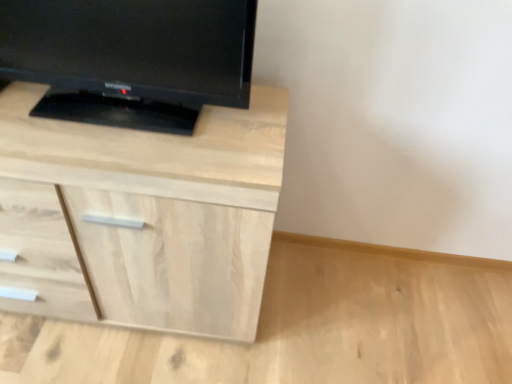
Locate an element on the screen. light wood chest of drawers at upper left is located at coordinates (150, 215).

Describe the element at coordinates (150, 215) in the screenshot. I see `light wood chest of drawers at upper left` at that location.

This screenshot has height=384, width=512. I want to click on matte black tv at upper left, so click(130, 58).

Describe the element at coordinates (130, 58) in the screenshot. I see `matte black tv at upper left` at that location.

At what (x,y) coordinates should I click in order to perform the action: click on light wood chest of drawers at upper left. Please return your answer as a coordinate pair (x, y). This screenshot has height=384, width=512. Looking at the image, I should click on (150, 215).

Between light wood chest of drawers at upper left and matte black tv at upper left, which one appears on the left side from the viewer's perspective?

light wood chest of drawers at upper left.

Is light wood chest of drawers at upper left further to the viewer compared to matte black tv at upper left?

Yes, light wood chest of drawers at upper left is behind matte black tv at upper left.

Does point (93, 172) come closer to viewer compared to point (55, 90)?

Yes, point (93, 172) is closer to viewer.

From the image's perspective, which one is positioned lower, light wood chest of drawers at upper left or matte black tv at upper left?

light wood chest of drawers at upper left.

From a real-world perspective, is light wood chest of drawers at upper left positioned under matte black tv at upper left based on gravity?

Indeed, from a real-world perspective, light wood chest of drawers at upper left is positioned beneath matte black tv at upper left.

In the scene shown: Considering the relative sizes of light wood chest of drawers at upper left and matte black tv at upper left in the image provided, is light wood chest of drawers at upper left wider than matte black tv at upper left?

Yes, light wood chest of drawers at upper left is wider than matte black tv at upper left.

Who is taller, light wood chest of drawers at upper left or matte black tv at upper left?

Standing taller between the two is light wood chest of drawers at upper left.

Does light wood chest of drawers at upper left have a smaller size compared to matte black tv at upper left?

Actually, light wood chest of drawers at upper left might be larger than matte black tv at upper left.

In the scene shown: Is light wood chest of drawers at upper left situated inside matte black tv at upper left or outside?

light wood chest of drawers at upper left cannot be found inside matte black tv at upper left.

Are light wood chest of drawers at upper left and matte black tv at upper left located far from each other?

That's not correct — light wood chest of drawers at upper left is a little close to matte black tv at upper left.

Is light wood chest of drawers at upper left looking in the opposite direction of matte black tv at upper left?

No, light wood chest of drawers at upper left is not facing away from matte black tv at upper left.

Locate an element on the screen. The image size is (512, 384). television above the light wood chest of drawers at upper left (from a real-world perspective) is located at coordinates (130, 58).

Based on their positions, is matte black tv at upper left located to the left or right of light wood chest of drawers at upper left?

Clearly, matte black tv at upper left is on the right of light wood chest of drawers at upper left in the image.

Considering their positions, is matte black tv at upper left located in front of or behind light wood chest of drawers at upper left?

Clearly, matte black tv at upper left is in front of light wood chest of drawers at upper left.

Is point (245, 102) less distant than point (30, 150)?

That is False.

From the image's perspective, between matte black tv at upper left and light wood chest of drawers at upper left, which one is located above?

matte black tv at upper left is shown above in the image.

From a real-world perspective, which object rests below the other?

In real-world perspective, light wood chest of drawers at upper left is lower.

Is matte black tv at upper left wider than light wood chest of drawers at upper left?

In fact, matte black tv at upper left might be narrower than light wood chest of drawers at upper left.

Considering the relative sizes of matte black tv at upper left and light wood chest of drawers at upper left in the image provided, is matte black tv at upper left taller than light wood chest of drawers at upper left?

Incorrect, the height of matte black tv at upper left is not larger of that of light wood chest of drawers at upper left.

Considering the sizes of objects matte black tv at upper left and light wood chest of drawers at upper left in the image provided, who is bigger, matte black tv at upper left or light wood chest of drawers at upper left?

Bigger between the two is light wood chest of drawers at upper left.

Is matte black tv at upper left not inside light wood chest of drawers at upper left?

Yes, matte black tv at upper left is outside of light wood chest of drawers at upper left.

Are matte black tv at upper left and light wood chest of drawers at upper left located far from each other?

That's not correct — matte black tv at upper left is a little close to light wood chest of drawers at upper left.

Is matte black tv at upper left turned away from light wood chest of drawers at upper left?

No, matte black tv at upper left is not facing away from light wood chest of drawers at upper left.

I want to click on television on the right of the light wood chest of drawers at upper left, so click(x=130, y=58).

The height and width of the screenshot is (384, 512). I want to click on television lying in front of the light wood chest of drawers at upper left, so click(x=130, y=58).

Locate an element on the screen. television above the light wood chest of drawers at upper left (from a real-world perspective) is located at coordinates (130, 58).